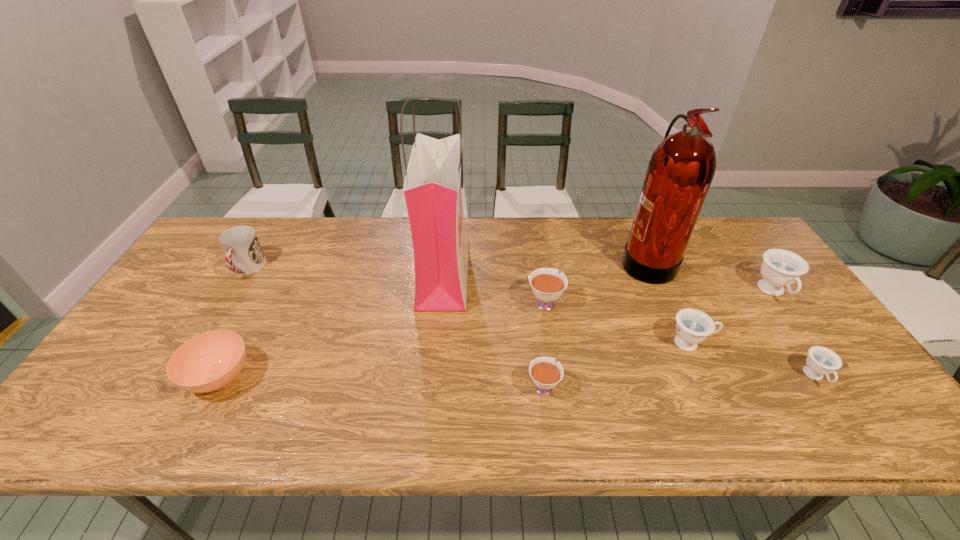
The height and width of the screenshot is (540, 960). Find the location of `blue teacup that is the closest to the smaller white teacup`. blue teacup that is the closest to the smaller white teacup is located at coordinates (693, 326).

You are a GUI agent. You are given a task and a screenshot of the screen. Output one action in this format:
    pyautogui.click(x=<x>, y=<y>)
    Task: Click on the free point that satisfies the following two spatial constraints: 1. on the side of the peach soup bowl where the handle is located; 2. on the right side of the red cup
    The image size is (960, 540).
    Given the screenshot: What is the action you would take?
    pyautogui.click(x=182, y=377)

Where is `blank area in the image that satisfies the following two spatial constraints: 1. on the side of the red cup where the handle is located; 2. on the left side of the peach soup bowl`? The height and width of the screenshot is (540, 960). blank area in the image that satisfies the following two spatial constraints: 1. on the side of the red cup where the handle is located; 2. on the left side of the peach soup bowl is located at coordinates (182, 377).

You are a GUI agent. You are given a task and a screenshot of the screen. Output one action in this format:
    pyautogui.click(x=<x>, y=<y>)
    Task: Click on the vacant space that satisfies the following two spatial constraints: 1. on the side of the farther white teacup with the handle; 2. on the front-facing side of the shopping bag
    The image size is (960, 540).
    Given the screenshot: What is the action you would take?
    pyautogui.click(x=540, y=271)

Identify the location of vacant space that satisfies the following two spatial constraints: 1. on the side of the smaller white teacup with the handle; 2. on the front-facing side of the pink shopping bag. This screenshot has height=540, width=960. (529, 271).